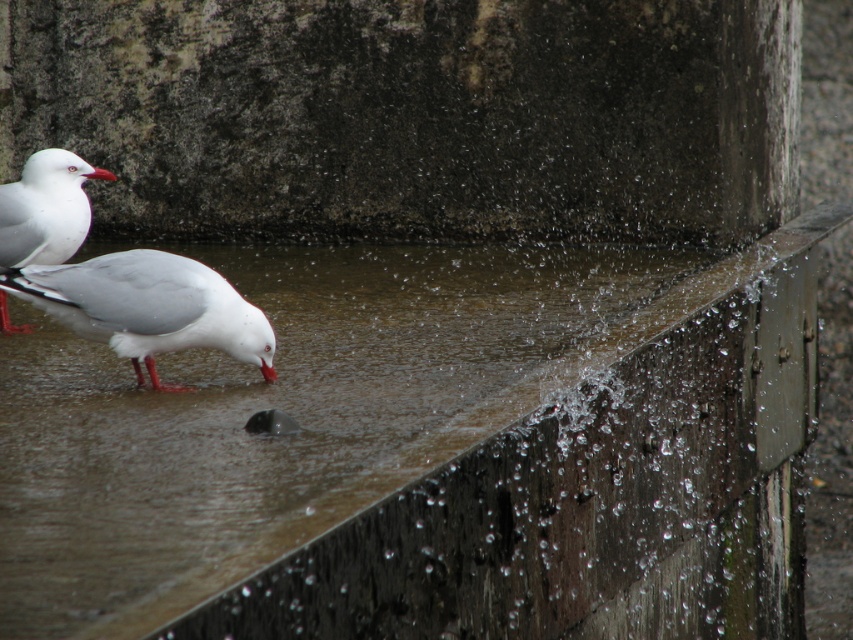
Is point (268, 352) in front of point (59, 163)?

Yes.

Is white matte bird at lower left thinner than white matte/glossy seagull at left?

No, white matte bird at lower left is not thinner than white matte/glossy seagull at left.

In order to click on white matte bird at lower left in this screenshot , I will do `click(148, 307)`.